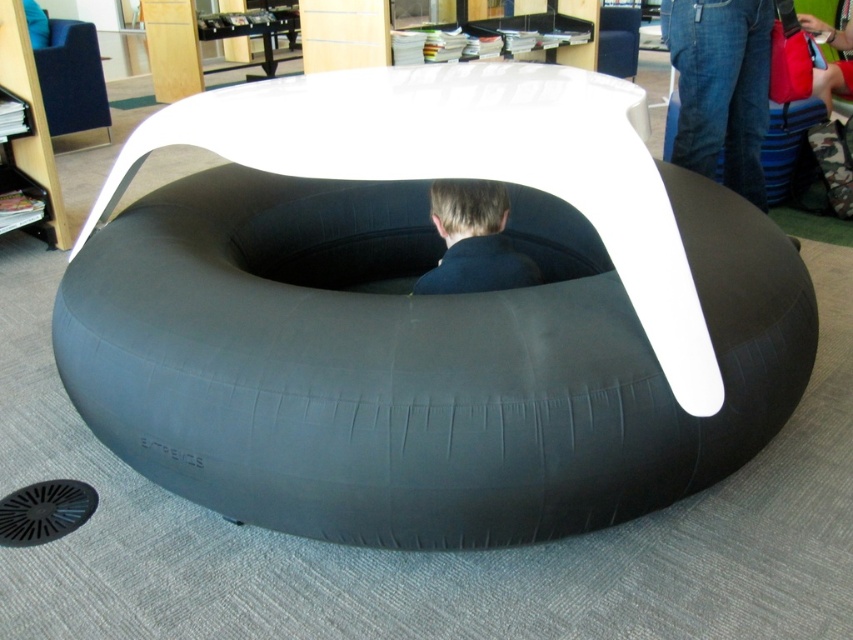
You are standing in front of the inflatable seating structure and want to reach a point marked at coordinates point (759,93). If you are 5 feet tall, can you comfortably reach that point without stretching?

The point (759,93) is 9.18 feet from the viewer. Since you are 5 feet tall, you cannot comfortably reach that point without stretching as it is significantly higher than your height.

From the picture: You are standing in the library and see the inflatable seating structure. There is a point marked at coordinates (473, 241). What color is the fabric at that point?

The point (473, 241) is on dark blue fabric at center.